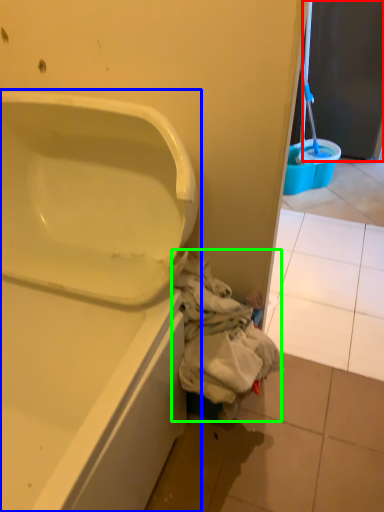
Question: Considering the real-world distances, which object is closest to screen door (highlighted by a red box)? bathtub (highlighted by a blue box) or garbage (highlighted by a green box).

Choices:
 (A) bathtub
 (B) garbage

Answer: (B)